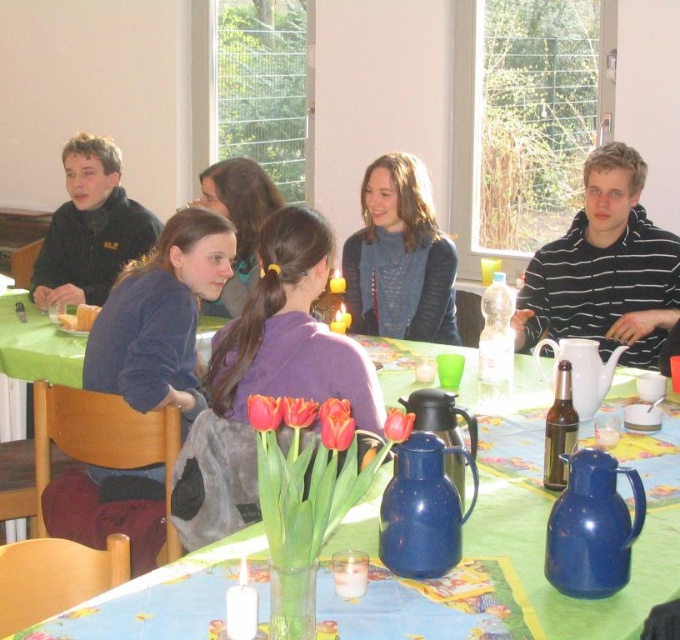
Is point (594, 452) positioned in front of point (466, 461)?

Yes.

Find the location of a particular element. blue plastic thermos at lower right is located at coordinates (592, 525).

Does blue ceramic jugs at center come behind blue sweater at center?

No, it is in front of blue sweater at center.

Between blue ceramic jugs at center and blue sweater at center, which one is positioned lower?

blue ceramic jugs at center is below.

Who is more forward, [250,545] or [386,291]?

Point [250,545]

Find the location of `blue ceramic jugs at center`. blue ceramic jugs at center is located at coordinates (547, 513).

Can you confirm if blue sweater at center is positioned to the right of matte black jacket at upper left?

Yes, blue sweater at center is to the right of matte black jacket at upper left.

Which is behind, point (375, 323) or point (85, 204)?

The point (85, 204) is more distant.

This screenshot has width=680, height=640. I want to click on blue sweater at center, so click(398, 257).